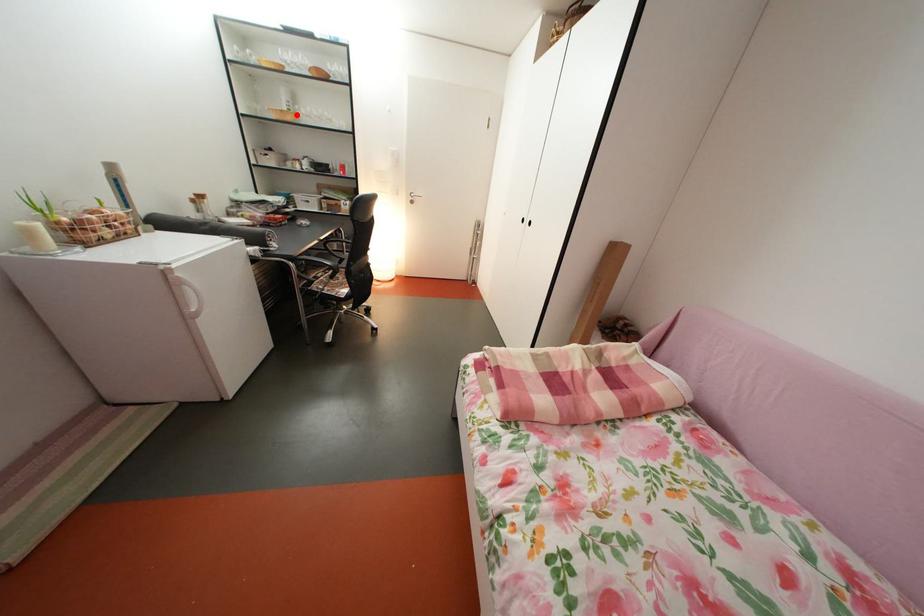
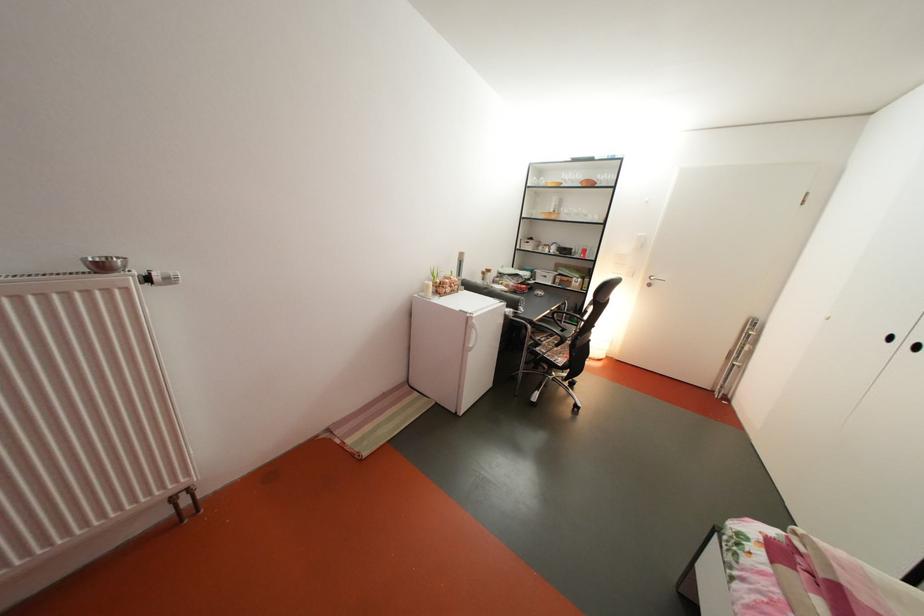
Question: I am providing you with two images of the same scene from different viewpoints. A red point is shown in image1. For the corresponding object point in image2, is it positioned nearer or farther from the camera?

Choices:
 (A) Nearer
 (B) Farther

Answer: (A)